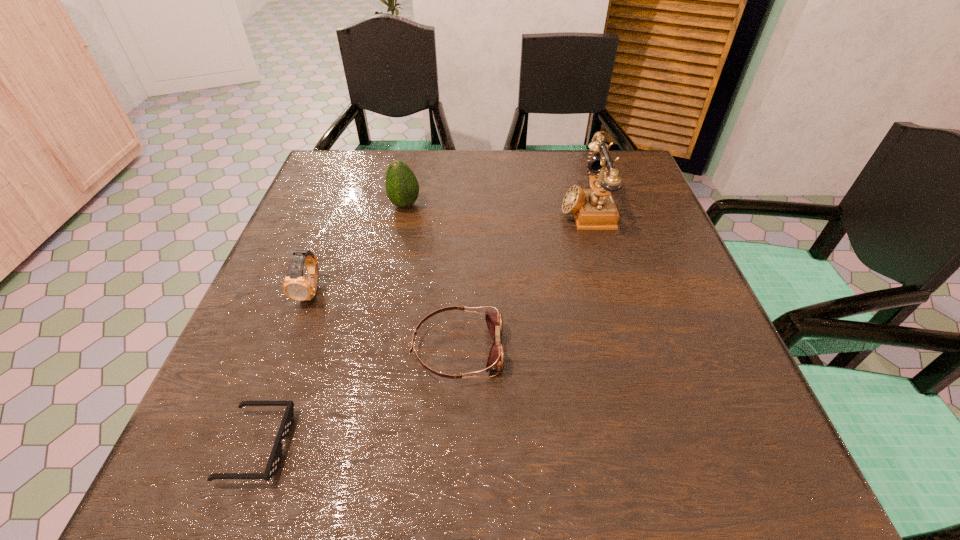
You are a GUI agent. You are given a task and a screenshot of the screen. Output one action in this format:
    pyautogui.click(x=<x>, y=<y>)
    Task: Click on the vacant area at the far right corner
    
    Given the screenshot: What is the action you would take?
    pyautogui.click(x=581, y=163)

You are a GUI agent. You are given a task and a screenshot of the screen. Output one action in this format:
    pyautogui.click(x=<x>, y=<y>)
    Task: Click on the free point between the fourth object from left to right and the nearest object
    The width and height of the screenshot is (960, 540).
    Given the screenshot: What is the action you would take?
    pyautogui.click(x=357, y=397)

At what (x,y) coordinates should I click in order to perform the action: click on free space that is in between the third nearest object and the fourth object from left to right. Please return your answer as a coordinate pair (x, y). The image size is (960, 540). Looking at the image, I should click on (385, 320).

Where is `empty space between the second object from right to left and the third object from right to left`? The image size is (960, 540). empty space between the second object from right to left and the third object from right to left is located at coordinates (431, 277).

Where is `free area in between the tallest object and the second object from right to left`? This screenshot has width=960, height=540. free area in between the tallest object and the second object from right to left is located at coordinates (521, 279).

Image resolution: width=960 pixels, height=540 pixels. I want to click on unoccupied area between the third object from left to right and the tallest object, so click(495, 207).

Find the location of `empty space between the nearest object and the watch`. empty space between the nearest object and the watch is located at coordinates (284, 368).

The height and width of the screenshot is (540, 960). I want to click on vacant space that's between the rightmost object and the nearest object, so 421,327.

I want to click on blank region between the fourth object from left to right and the watch, so point(385,320).

This screenshot has height=540, width=960. What are the coordinates of `free space that is in between the avocado and the second object from right to left` in the screenshot? It's located at (431, 277).